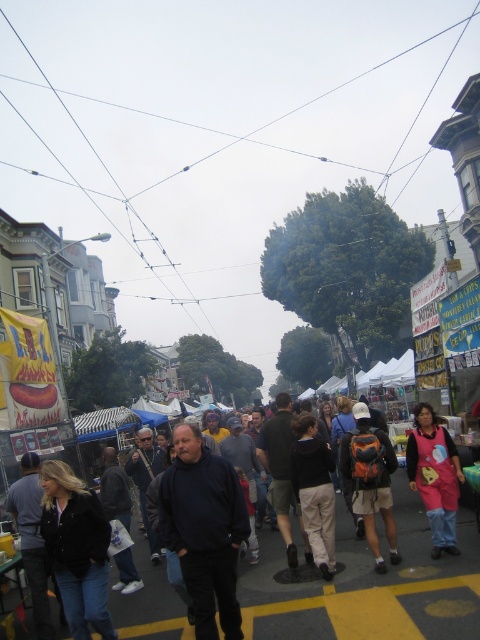
Question: Observing the image, what is the correct spatial positioning of dark blue sweatshirt at center in reference to pink fabric costume at lower right?

Choices:
 (A) above
 (B) below

Answer: (B)

Question: Among these points, which one is farthest from the camera?

Choices:
 (A) (273, 560)
 (B) (429, 422)

Answer: (A)

Question: Is dark blue sweatshirt at center smaller than pink fabric costume at lower right?

Choices:
 (A) yes
 (B) no

Answer: (B)

Question: Does dark blue sweatshirt at center appear over pink fabric costume at lower right?

Choices:
 (A) yes
 (B) no

Answer: (B)